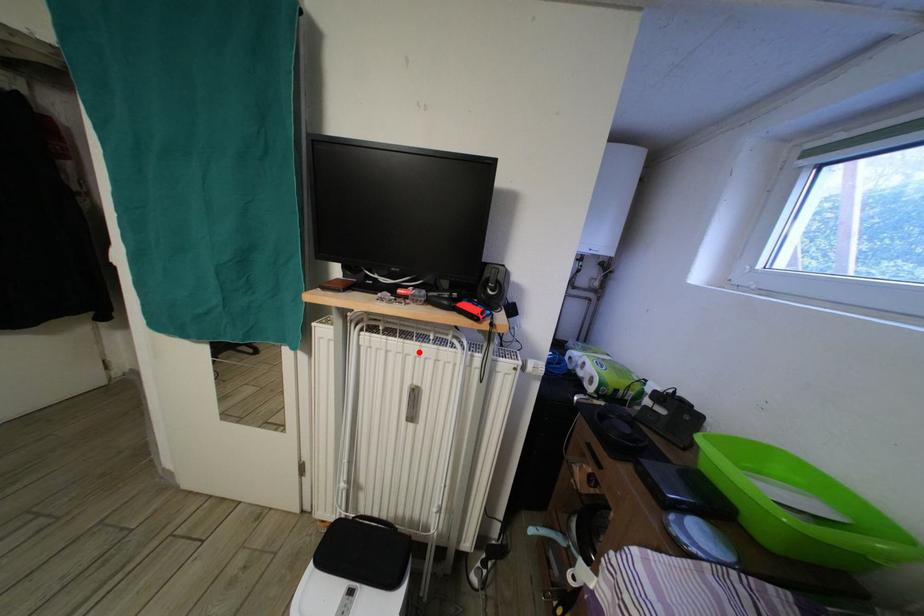
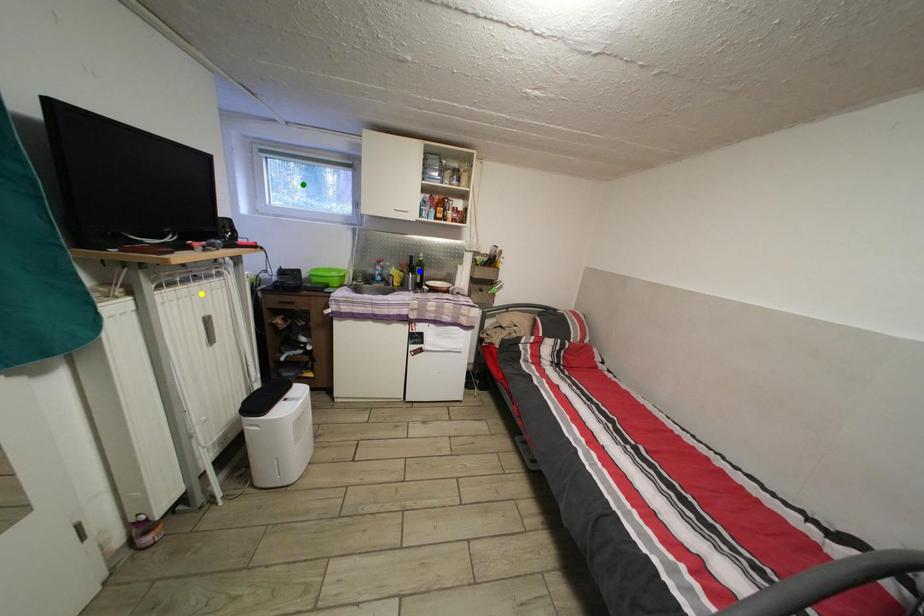
Question: I am providing you with two images of the same scene from different viewpoints. A red point is marked on the first image. You are given multiple points on the second image. Can you choose the point in image 2 that corresponds to the point in image 1?

Choices:
 (A) green point
 (B) yellow point
 (C) blue point

Answer: (B)